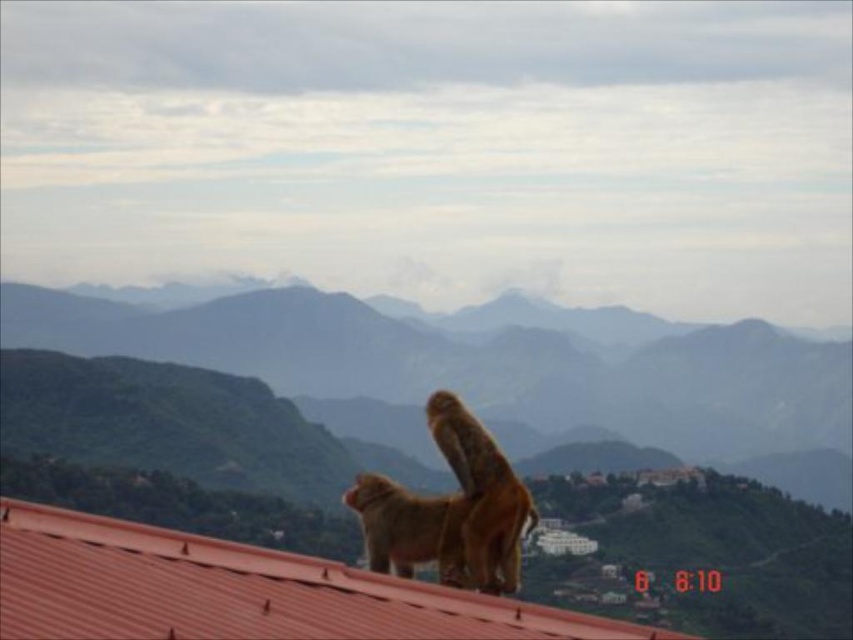
Question: Can you confirm if green textured mountain at upper center is thinner than metallic red roof at center?

Choices:
 (A) no
 (B) yes

Answer: (A)

Question: In this image, where is green textured mountain at upper center located relative to metallic red roof at center?

Choices:
 (A) above
 (B) below

Answer: (B)

Question: Which of the following is the farthest from the observer?

Choices:
 (A) metallic red roof at center
 (B) green textured mountain at upper center

Answer: (B)

Question: Which point is closer to the camera?

Choices:
 (A) green textured mountain at upper center
 (B) metallic red roof at center

Answer: (B)

Question: Which point is farther from the camera taking this photo?

Choices:
 (A) pyautogui.click(x=28, y=428)
 (B) pyautogui.click(x=248, y=566)

Answer: (A)

Question: Can you confirm if green textured mountain at upper center is positioned to the left of metallic red roof at center?

Choices:
 (A) yes
 (B) no

Answer: (A)